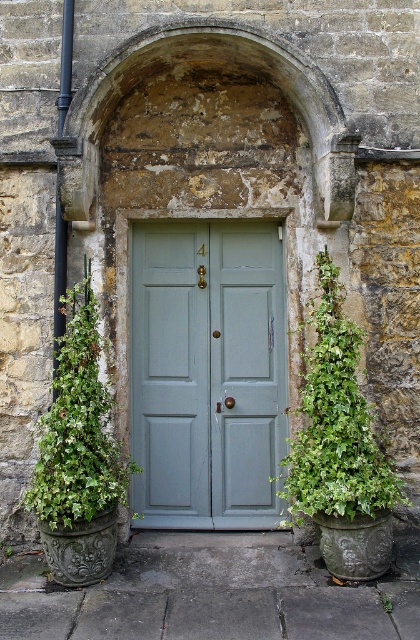
Looking at this image, you are standing at the entrance of the traditional stone building and want to take a photo. You notice two points marked as point 1 and point 2. Point 1 is at coordinate (184,396) and point 2 is at coordinate (94,412). Which point is closer to your camera lens?

Point 1 at coordinate (184,396) is closer to the camera lens than point 2 at coordinate (94,412) because it is further to the camera.